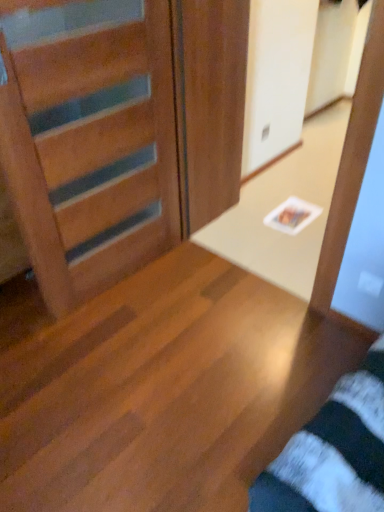
Question: Should I look upward or downward to see wooden door at center?

Choices:
 (A) up
 (B) down

Answer: (A)